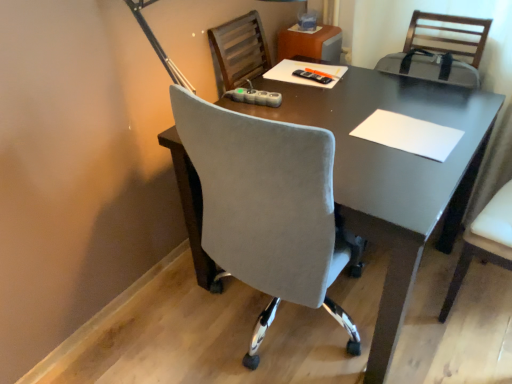
Question: Is black plastic remote control at center in front of white paper at center?

Choices:
 (A) yes
 (B) no

Answer: (B)

Question: Is black plastic remote control at center located outside white paper at center?

Choices:
 (A) no
 (B) yes

Answer: (B)

Question: Does black plastic remote control at center touch white paper at center?

Choices:
 (A) yes
 (B) no

Answer: (B)

Question: Can you confirm if black plastic remote control at center is smaller than white paper at center?

Choices:
 (A) no
 (B) yes

Answer: (B)

Question: From the image's perspective, is black plastic remote control at center over white paper at center?

Choices:
 (A) no
 (B) yes

Answer: (B)

Question: Is white leather chair at right taller or shorter than black plastic remote control at center?

Choices:
 (A) tall
 (B) short

Answer: (A)

Question: Considering the positions of white leather chair at right and black plastic remote control at center in the image, is white leather chair at right bigger or smaller than black plastic remote control at center?

Choices:
 (A) small
 (B) big

Answer: (B)

Question: From a real-world perspective, is white leather chair at right positioned above or below black plastic remote control at center?

Choices:
 (A) above
 (B) below

Answer: (B)

Question: In the image, is white leather chair at right positioned in front of or behind black plastic remote control at center?

Choices:
 (A) behind
 (B) front

Answer: (B)

Question: Is white leather chair at right in front of or behind white paper at center in the image?

Choices:
 (A) front
 (B) behind

Answer: (A)

Question: Is point (445, 301) closer or farther from the camera than point (367, 122)?

Choices:
 (A) closer
 (B) farther

Answer: (B)

Question: Is white leather chair at right situated inside white paper at center or outside?

Choices:
 (A) outside
 (B) inside

Answer: (A)

Question: Considering the positions of white leather chair at right and white paper at center in the image, is white leather chair at right wider or thinner than white paper at center?

Choices:
 (A) thin
 (B) wide

Answer: (B)

Question: From the image's perspective, is black plastic remote control at center above or below white paper at center?

Choices:
 (A) below
 (B) above

Answer: (B)

Question: In the image, is black plastic remote control at center positioned in front of or behind white paper at center?

Choices:
 (A) behind
 (B) front

Answer: (A)